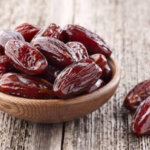
Find the location of `lighter wood table`. lighter wood table is located at coordinates (134, 14), (58, 8).